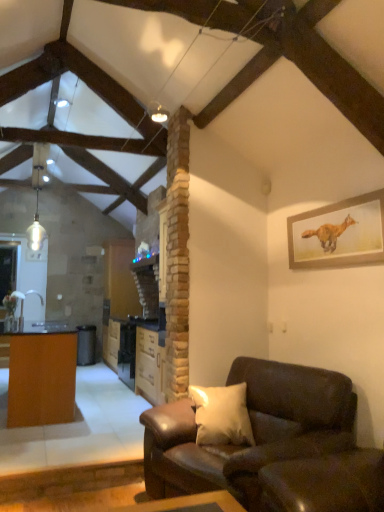
Question: In terms of width, does wooden table at left look wider or thinner when compared to wooden framed fox painting at upper right?

Choices:
 (A) wide
 (B) thin

Answer: (A)

Question: Is wooden table at left spatially inside wooden framed fox painting at upper right, or outside of it?

Choices:
 (A) inside
 (B) outside

Answer: (B)

Question: Which object is positioned closest to the wooden table at left?

Choices:
 (A) brown wood cabinet at center
 (B) wooden framed fox painting at upper right
 (C) leather couch at lower right

Answer: (A)

Question: Estimate the real-world distances between objects in this image. Which object is farther from the wooden table at left?

Choices:
 (A) wooden framed fox painting at upper right
 (B) brown wood cabinet at center
 (C) leather couch at lower right

Answer: (A)